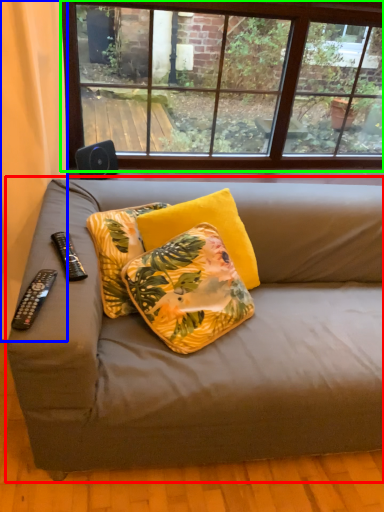
Question: Considering the real-world distances, which object is farthest from studio couch (highlighted by a red box)? curtain (highlighted by a blue box) or window (highlighted by a green box)?

Choices:
 (A) curtain
 (B) window

Answer: (B)